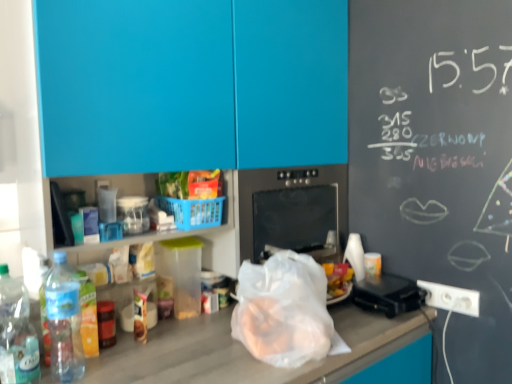
Question: Considering the relative sizes of blue matte cabinet at upper center and clear plastic bottle at lower left, the 2th bottle from the left, in the image provided, is blue matte cabinet at upper center taller than clear plastic bottle at lower left, the 2th bottle from the left,?

Choices:
 (A) no
 (B) yes

Answer: (B)

Question: From the image's perspective, is blue matte cabinet at upper center below clear plastic bottle at lower left, the first bottle when ordered from right to left?

Choices:
 (A) no
 (B) yes

Answer: (A)

Question: Is blue matte cabinet at upper center turned away from clear plastic bottle at lower left, the first bottle when ordered from right to left?

Choices:
 (A) no
 (B) yes

Answer: (A)

Question: Is blue matte cabinet at upper center closer to camera compared to clear plastic bottle at lower left, the first bottle when ordered from right to left?

Choices:
 (A) no
 (B) yes

Answer: (B)

Question: Are blue matte cabinet at upper center and clear plastic bottle at lower left, the first bottle when ordered from right to left, making contact?

Choices:
 (A) no
 (B) yes

Answer: (A)

Question: From a real-world perspective, is blue matte cabinet at upper center positioned over clear plastic bottle at lower left, the first bottle when ordered from right to left, based on gravity?

Choices:
 (A) yes
 (B) no

Answer: (A)

Question: Considering the relative sizes of clear plastic bottle at lower left, the 2th bottle from the left, and shiny plastic bag of chips at center in the image provided, is clear plastic bottle at lower left, the 2th bottle from the left, wider than shiny plastic bag of chips at center?

Choices:
 (A) yes
 (B) no

Answer: (B)

Question: From a real-world perspective, is clear plastic bottle at lower left, the first bottle when ordered from right to left, on top of shiny plastic bag of chips at center?

Choices:
 (A) yes
 (B) no

Answer: (B)

Question: Does clear plastic bottle at lower left, the 2th bottle from the left, have a lesser width compared to shiny plastic bag of chips at center?

Choices:
 (A) yes
 (B) no

Answer: (A)

Question: Can you confirm if clear plastic bottle at lower left, the first bottle when ordered from right to left, is bigger than shiny plastic bag of chips at center?

Choices:
 (A) no
 (B) yes

Answer: (B)

Question: Is clear plastic bottle at lower left, the 2th bottle from the left, oriented towards shiny plastic bag of chips at center?

Choices:
 (A) no
 (B) yes

Answer: (A)

Question: Can you confirm if clear plastic bottle at lower left, the 2th bottle from the left, is taller than shiny plastic bag of chips at center?

Choices:
 (A) yes
 (B) no

Answer: (A)

Question: Is shiny plastic bag of chips at center further to the viewer compared to black plastic toaster at right?

Choices:
 (A) yes
 (B) no

Answer: (B)